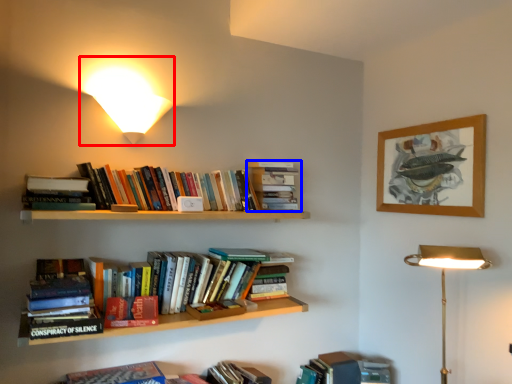
Question: Which point is closer to the camera, lamp (highlighted by a red box) or book (highlighted by a blue box)?

Choices:
 (A) lamp
 (B) book

Answer: (A)